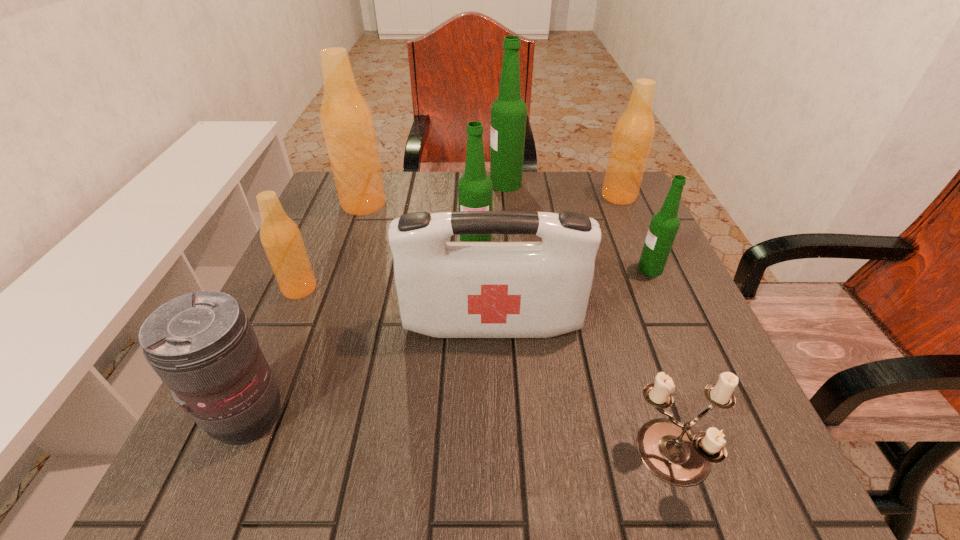
This screenshot has height=540, width=960. I want to click on free space located on the label of the rightmost green beer bottle, so click(606, 269).

Locate an element on the screen. free region located 0.390m on the label of the rightmost green beer bottle is located at coordinates (460, 269).

Locate an element on the screen. The width and height of the screenshot is (960, 540). vacant space located on the label of the rightmost green beer bottle is located at coordinates (455, 269).

The height and width of the screenshot is (540, 960). Identify the location of blank space located on the back of the smallest tan beer bottle. (320, 243).

The height and width of the screenshot is (540, 960). What are the coordinates of `free point located on the side of the telephoto lens where the control switches are located` in the screenshot? It's located at (344, 416).

You are a GUI agent. You are given a task and a screenshot of the screen. Output one action in this format:
    pyautogui.click(x=<x>, y=<y>)
    Task: Click on the free space located on the back of the candle holder
    The image size is (960, 540).
    Given the screenshot: What is the action you would take?
    pyautogui.click(x=635, y=336)

The height and width of the screenshot is (540, 960). Identify the location of telephoto lens at the near edge. (202, 345).

Image resolution: width=960 pixels, height=540 pixels. In order to click on candle holder present at the near edge in this screenshot , I will do `click(672, 451)`.

Image resolution: width=960 pixels, height=540 pixels. In order to click on telephoto lens that is at the left edge in this screenshot , I will do `click(202, 345)`.

Identify the location of candle holder situated at the right edge. (672, 451).